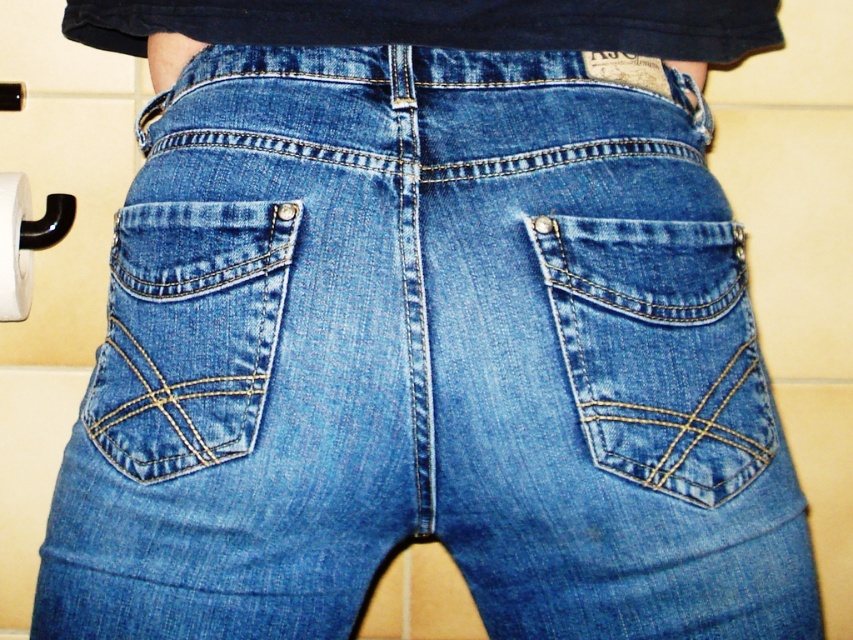
Is denim blue jeans pocket at lower left in front of white paper roll at lower left?

That is True.

Where is `denim blue jeans pocket at lower left`? denim blue jeans pocket at lower left is located at coordinates (189, 333).

The image size is (853, 640). Find the location of `denim blue jeans pocket at lower left`. denim blue jeans pocket at lower left is located at coordinates (189, 333).

Is the position of denim/jeans pocket at center more distant than that of white matte toilet paper at lower left?

No, denim/jeans pocket at center is in front of white matte toilet paper at lower left.

At what (x,y) coordinates should I click in order to perform the action: click on denim/jeans pocket at center. Please return your answer as a coordinate pair (x, y). Looking at the image, I should click on (659, 349).

In order to click on denim/jeans pocket at center in this screenshot , I will do `click(659, 349)`.

Can you confirm if denim/jeans pocket at center is positioned to the right of white paper roll at lower left?

Correct, you'll find denim/jeans pocket at center to the right of white paper roll at lower left.

Between denim/jeans pocket at center and white paper roll at lower left, which one appears on the left side from the viewer's perspective?

From the viewer's perspective, white paper roll at lower left appears more on the left side.

Is point (569, 369) positioned after point (20, 211)?

No, (569, 369) is closer to viewer.

Locate an element on the screen. The height and width of the screenshot is (640, 853). denim/jeans pocket at center is located at coordinates (659, 349).